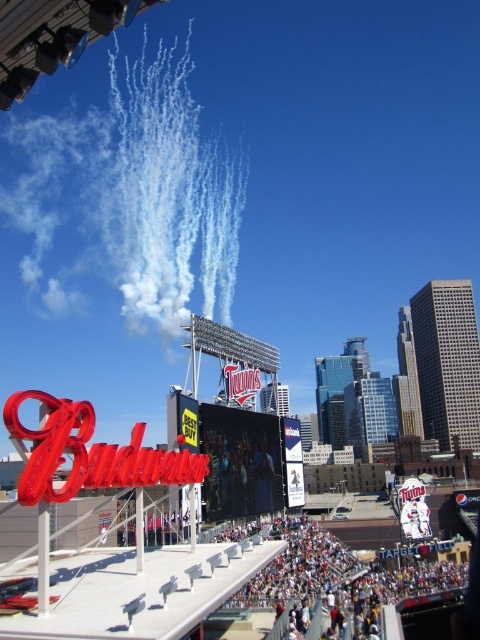
How distant is white vapor trails at upper center from white cotton crowd at lower center?

white vapor trails at upper center and white cotton crowd at lower center are 184.01 meters apart.

Between point (192, 138) and point (312, 612), which one is positioned behind?

Point (192, 138)

Find the location of a particular element. The image size is (480, 640). white vapor trails at upper center is located at coordinates point(169,192).